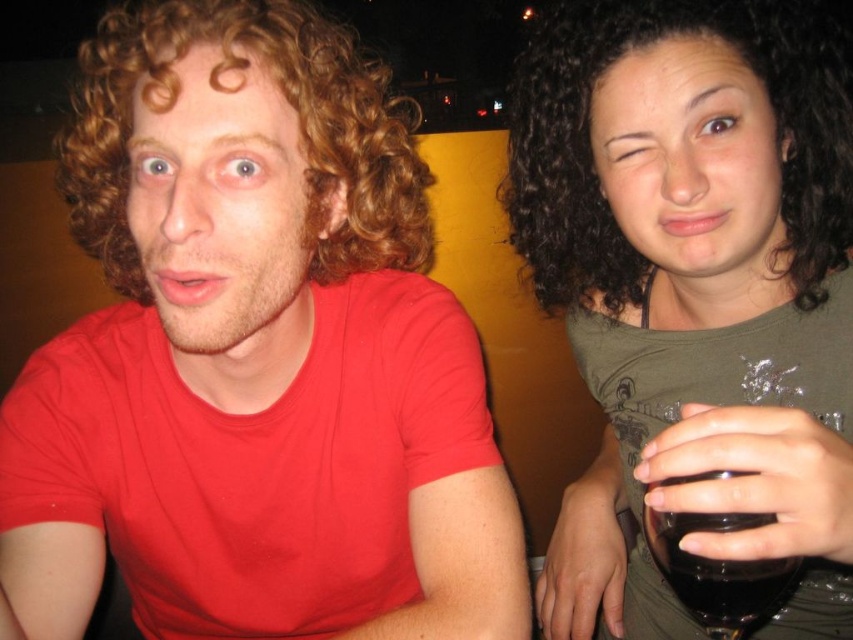
Looking at this image, is matte red shirt at center below dark glass at right?

No, matte red shirt at center is not below dark glass at right.

The height and width of the screenshot is (640, 853). What do you see at coordinates (254, 358) in the screenshot? I see `matte red shirt at center` at bounding box center [254, 358].

Who is more forward, (375, 154) or (717, 620)?

Point (717, 620) is more forward.

You are a GUI agent. You are given a task and a screenshot of the screen. Output one action in this format:
    pyautogui.click(x=<x>, y=<y>)
    Task: Click on the matte red shirt at center
    Image resolution: width=853 pixels, height=640 pixels.
    Given the screenshot: What is the action you would take?
    pyautogui.click(x=254, y=358)

In order to click on green matte shirt at upper right in this screenshot , I will do `click(693, 289)`.

Can you confirm if green matte shirt at upper right is smaller than dark glass at right?

No, green matte shirt at upper right is not smaller than dark glass at right.

Between point (767, 532) and point (729, 580), which one is positioned in front?

Point (767, 532) is more forward.

Where is `green matte shirt at upper right`? This screenshot has height=640, width=853. green matte shirt at upper right is located at coordinates (693, 289).

Who is taller, matte red shirt at center or green matte shirt at upper right?

With more height is matte red shirt at center.

Between matte red shirt at center and green matte shirt at upper right, which one is positioned higher?

green matte shirt at upper right

Where is `matte red shirt at center`? The width and height of the screenshot is (853, 640). matte red shirt at center is located at coordinates (254, 358).